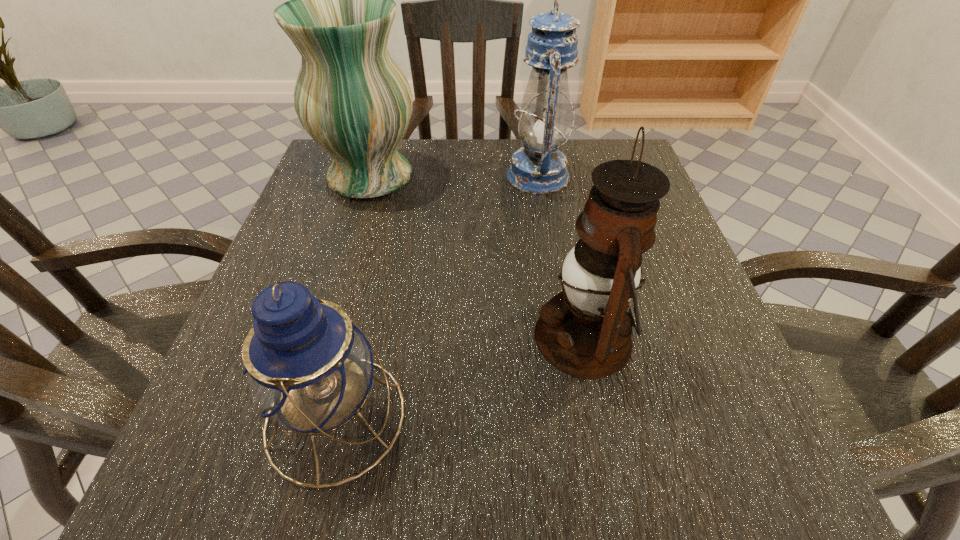
The height and width of the screenshot is (540, 960). Find the location of `lantern identified as the second closest to the vase`. lantern identified as the second closest to the vase is located at coordinates (585, 331).

Identify the location of lantern that is the second closest to the shortest object. The width and height of the screenshot is (960, 540). (539, 168).